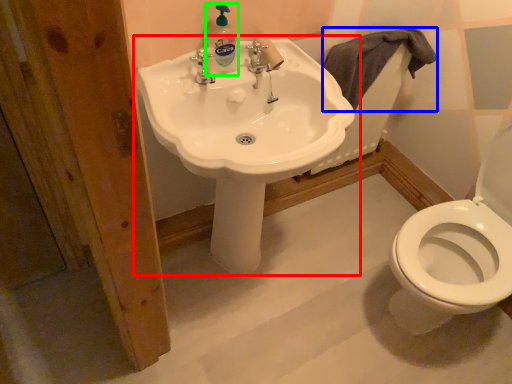
Question: Estimate the real-world distances between objects in this image. Which object is closer to sink (highlighted by a red box), bath towel (highlighted by a blue box) or cleaning product (highlighted by a green box)?

Choices:
 (A) bath towel
 (B) cleaning product

Answer: (B)